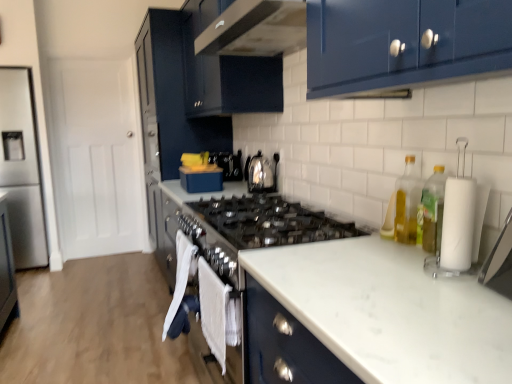
Question: Is white towel at lower center taller or shorter than clear glass bottle at right, the first bottle from the back?

Choices:
 (A) short
 (B) tall

Answer: (B)

Question: From the image's perspective, is white towel at lower center above or below clear glass bottle at right, the first bottle from the back?

Choices:
 (A) above
 (B) below

Answer: (B)

Question: Based on their relative distances, which object is nearer to the clear glass bottle at right, arranged as the second bottle when viewed from the front?

Choices:
 (A) wooden floor at lower left
 (B) glossy black cabinet at upper center, which ranks as the 1th cabinetry in front-to-back order
 (C) white towel at lower center
 (D) glossy black range hood at upper center
 (E) glossy dark blue cabinet at center, which appears as the 1th cabinetry when viewed from the back

Answer: (C)

Question: Which object is positioned closest to the wooden floor at lower left?

Choices:
 (A) clear glass bottle at right, the first bottle from the back
 (B) glossy dark blue cabinet at center, which appears as the 1th cabinetry when viewed from the back
 (C) glossy black cabinet at upper center, the 2th cabinetry in the back-to-front sequence
 (D) yellow translucent bottle at right, marked as the first bottle in a front-to-back arrangement
 (E) white matte paper towel at right

Answer: (B)